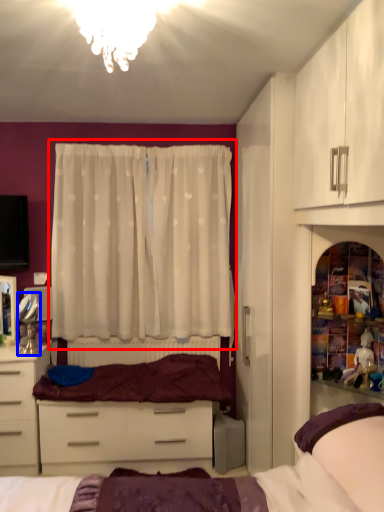
Question: Which of the following is the closest to the observer, curtain (highlighted by a red box) or mirror (highlighted by a blue box)?

Choices:
 (A) curtain
 (B) mirror

Answer: (B)